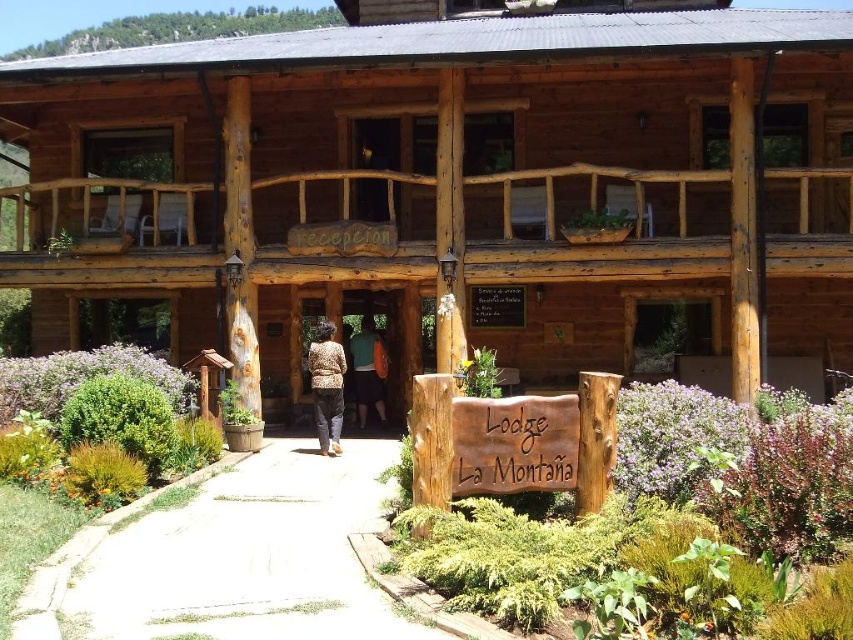
Is white gravel path at center in front of matte green backpack at center?

That is True.

Can you confirm if white gravel path at center is positioned above matte green backpack at center?

Actually, white gravel path at center is below matte green backpack at center.

Between point (148, 566) and point (373, 339), which one is positioned behind?

The point (373, 339) is behind.

Find the location of a particular element. white gravel path at center is located at coordinates (231, 557).

Looking at this image, who is taller, leopard print sweater at center or matte green backpack at center?

leopard print sweater at center

Is point (328, 353) less distant than point (354, 355)?

Yes.

Between point (332, 403) and point (386, 419), which one is positioned behind?

The point (386, 419) is behind.

Where is `leopard print sweater at center`? The image size is (853, 640). leopard print sweater at center is located at coordinates (328, 387).

Is white gravel path at center positioned at the back of leopard print sweater at center?

No, white gravel path at center is closer to the viewer.

Who is positioned more to the left, white gravel path at center or leopard print sweater at center?

From the viewer's perspective, white gravel path at center appears more on the left side.

Image resolution: width=853 pixels, height=640 pixels. What do you see at coordinates (231, 557) in the screenshot?
I see `white gravel path at center` at bounding box center [231, 557].

The height and width of the screenshot is (640, 853). What are the coordinates of `white gravel path at center` in the screenshot? It's located at (231, 557).